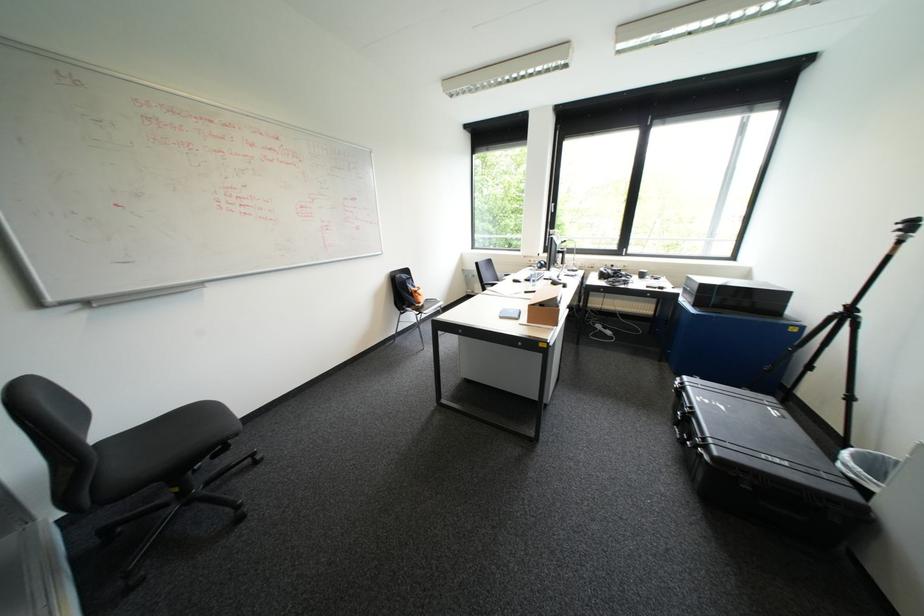
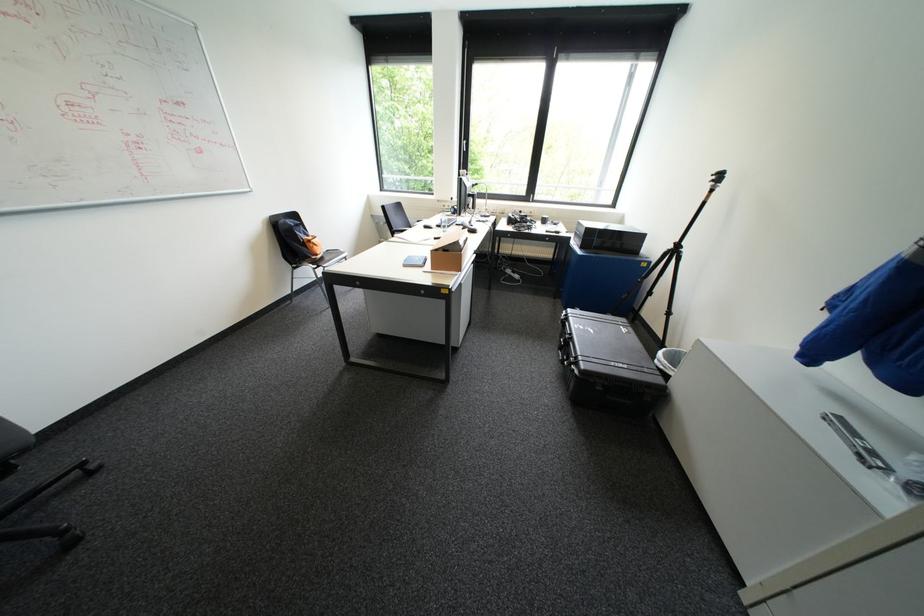
Find the pixel in the second image that matches (684,426) in the first image.

(567, 350)